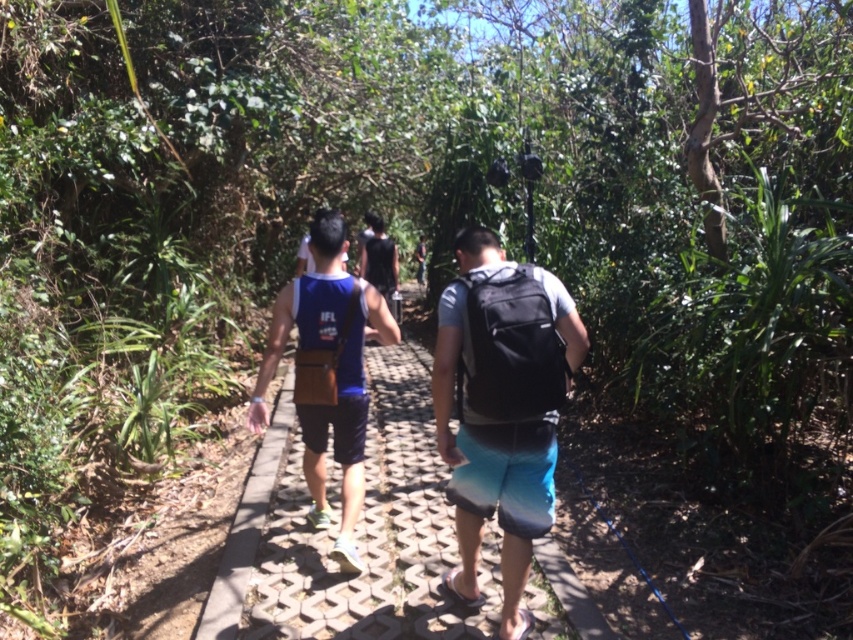
Question: Where is black matte backpack at center located in relation to blue fabric tank top at center in the image?

Choices:
 (A) above
 (B) below

Answer: (B)

Question: Can you confirm if black matte backpack at center is positioned to the left of blue fabric tank top at center?

Choices:
 (A) no
 (B) yes

Answer: (A)

Question: In this image, where is black matte backpack at center located relative to blue fabric tank top at center?

Choices:
 (A) left
 (B) right

Answer: (B)

Question: Which of the following is the closest to the observer?

Choices:
 (A) black matte backpack at center
 (B) blue fabric backpack at center

Answer: (A)

Question: Which of the following is the closest to the observer?

Choices:
 (A) (376, 305)
 (B) (550, 458)
 (C) (527, 472)

Answer: (C)

Question: Which point is farther to the camera?

Choices:
 (A) pyautogui.click(x=343, y=513)
 (B) pyautogui.click(x=460, y=275)

Answer: (A)